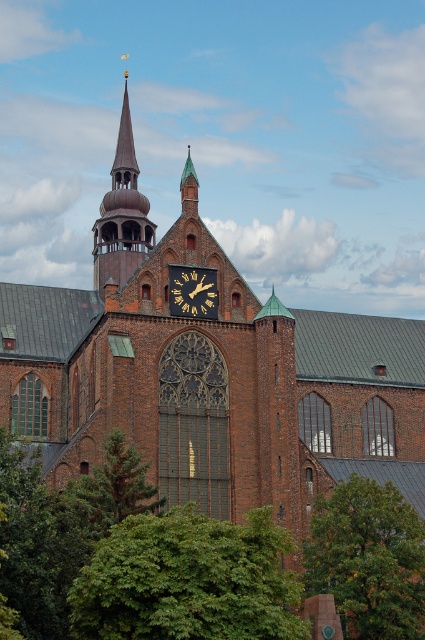
You are standing in front of the historic church and notice a point marked at coordinates (368, 560). Based on the church scene described, what object or feature is located at this coordinate?

The point at coordinates (368, 560) corresponds to the green leafy tree at lower right.